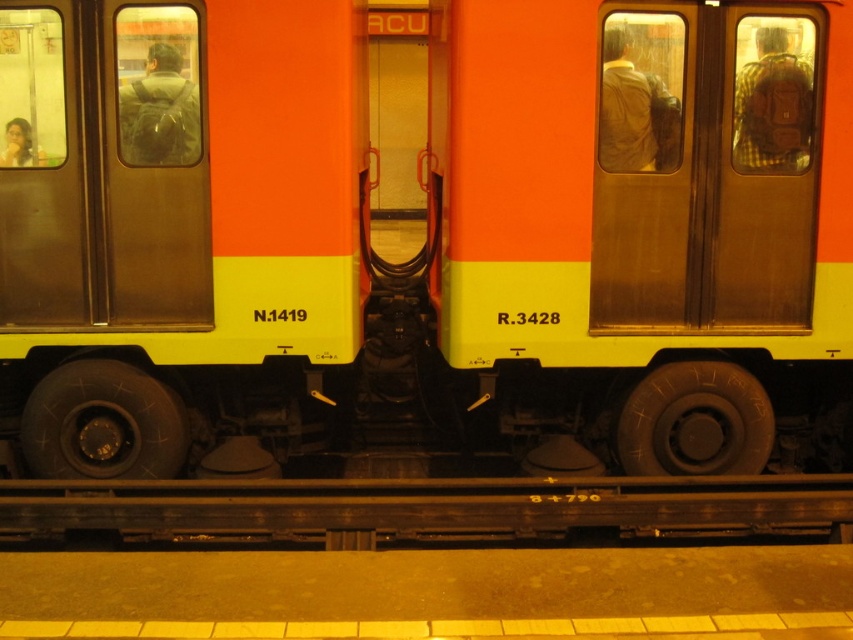
Question: Among these points, which one is farthest from the camera?

Choices:
 (A) (746, 81)
 (B) (209, 488)

Answer: (A)

Question: Is metallic gold door at right above metal at bottom?

Choices:
 (A) yes
 (B) no

Answer: (A)

Question: Can you confirm if metallic gold door at right is bigger than metal at bottom?

Choices:
 (A) yes
 (B) no

Answer: (A)

Question: Does metallic gold door at right come in front of metal at bottom?

Choices:
 (A) yes
 (B) no

Answer: (B)